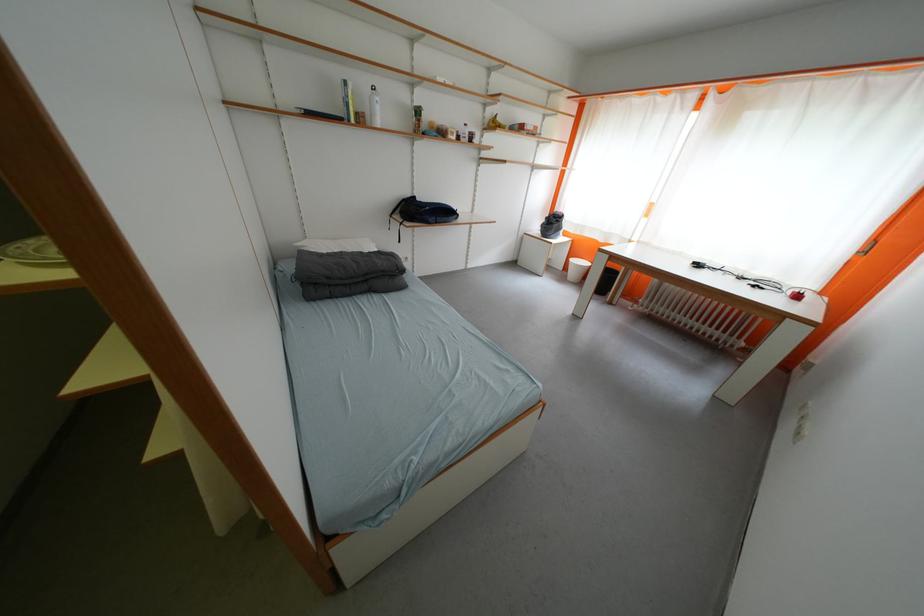
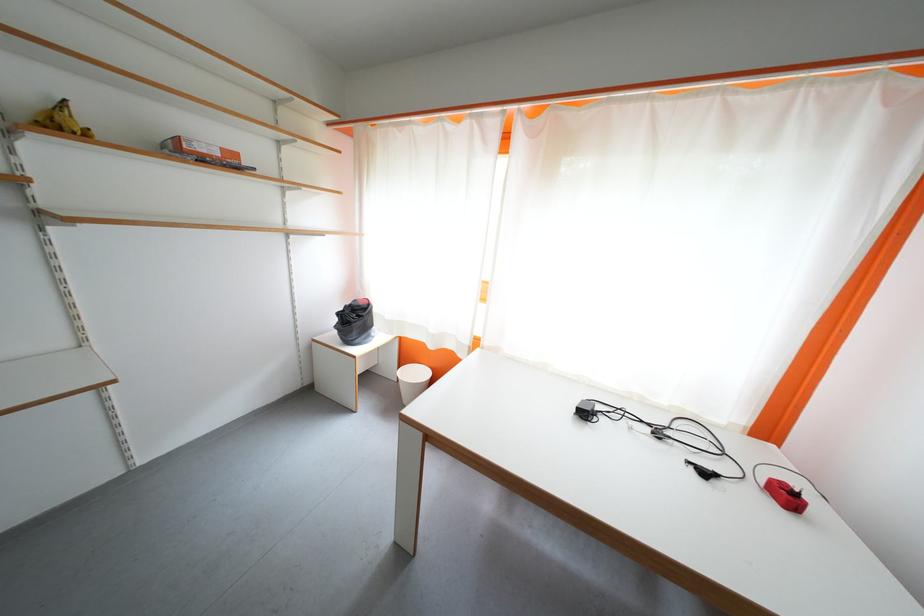
In the second image, find the point that corresponds to (x=611, y=244) in the first image.

(440, 350)